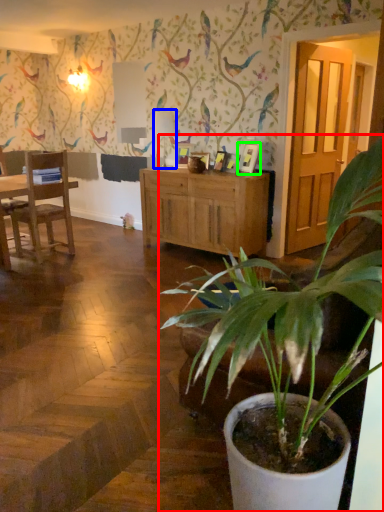
Question: Which is farther away from houseplant (highlighted by a red box)? lamp (highlighted by a blue box) or picture frame (highlighted by a green box)?

Choices:
 (A) lamp
 (B) picture frame

Answer: (A)